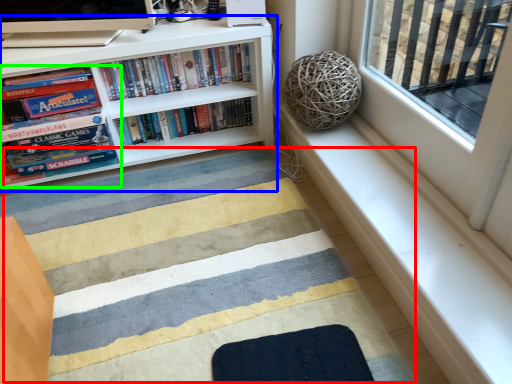
Question: Estimate the real-world distances between objects in this image. Which object is farther from doormat (highlighted by a red box), bookcase (highlighted by a blue box) or book (highlighted by a green box)?

Choices:
 (A) bookcase
 (B) book

Answer: (B)